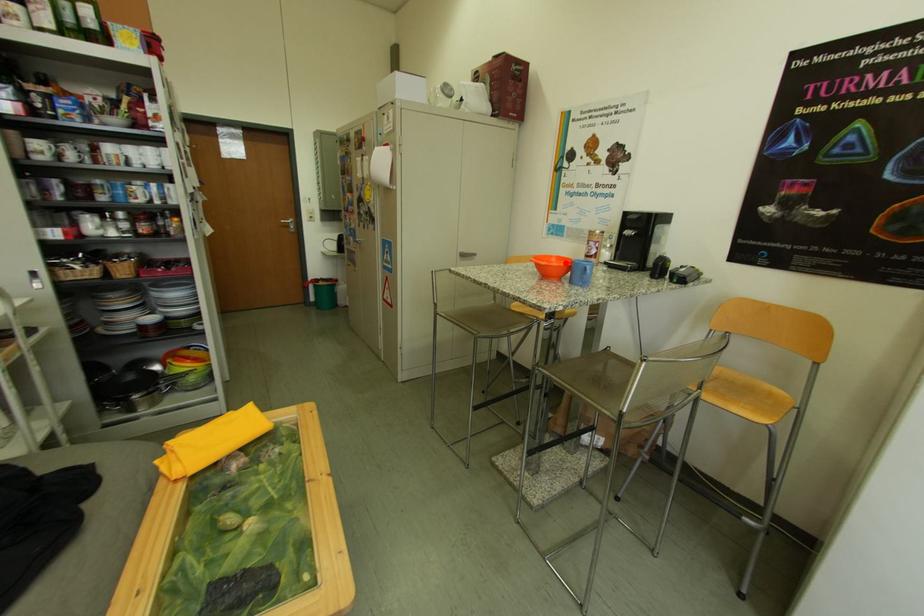
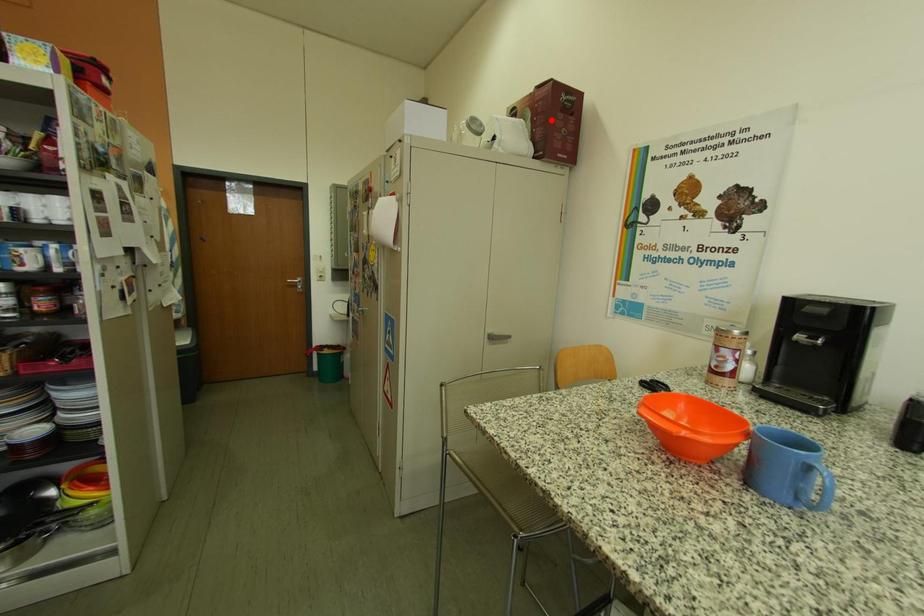
I am providing you with two images of the same scene from different viewpoints. A red point is marked on the first image and another point is marked on the second image. Are the points marked in image1 and image2 representing the same 3D position?

No